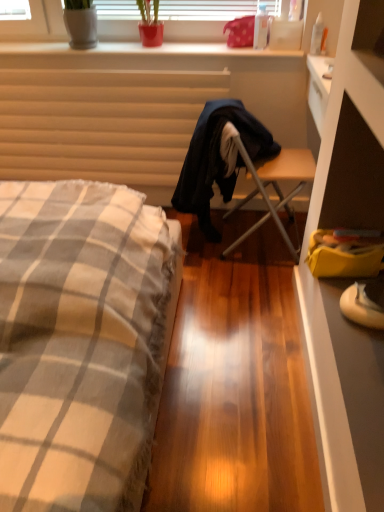
Question: Can you confirm if dark blue fabric robe at center is positioned to the left of checkered fabric bed at left?

Choices:
 (A) no
 (B) yes

Answer: (A)

Question: Is dark blue fabric robe at center surrounding checkered fabric bed at left?

Choices:
 (A) yes
 (B) no

Answer: (B)

Question: Does dark blue fabric robe at center have a lesser width compared to checkered fabric bed at left?

Choices:
 (A) no
 (B) yes

Answer: (B)

Question: Could you tell me if dark blue fabric robe at center is turned towards checkered fabric bed at left?

Choices:
 (A) yes
 (B) no

Answer: (B)

Question: Is dark blue fabric robe at center located outside checkered fabric bed at left?

Choices:
 (A) yes
 (B) no

Answer: (A)

Question: From the image's perspective, is smooth white surface at upper center above or below checkered fabric bed at left?

Choices:
 (A) above
 (B) below

Answer: (A)

Question: Looking at their shapes, would you say smooth white surface at upper center is wider or thinner than checkered fabric bed at left?

Choices:
 (A) wide
 (B) thin

Answer: (B)

Question: From a real-world perspective, relative to checkered fabric bed at left, is smooth white surface at upper center vertically above or below?

Choices:
 (A) above
 (B) below

Answer: (A)

Question: Considering the relative positions of smooth white surface at upper center and checkered fabric bed at left in the image provided, is smooth white surface at upper center to the left or to the right of checkered fabric bed at left?

Choices:
 (A) right
 (B) left

Answer: (A)

Question: From a real-world perspective, relative to transparent plastic bottle at upper right, marked as the first bottle in a right-to-left arrangement, is yellow fabric bag at lower right vertically above or below?

Choices:
 (A) above
 (B) below

Answer: (B)

Question: Is point (322, 245) closer or farther from the camera than point (316, 31)?

Choices:
 (A) farther
 (B) closer

Answer: (B)

Question: Visually, is yellow fabric bag at lower right positioned to the left or to the right of transparent plastic bottle at upper right, positioned as the second bottle in left-to-right order?

Choices:
 (A) left
 (B) right

Answer: (A)

Question: In the image, is yellow fabric bag at lower right positioned in front of or behind transparent plastic bottle at upper right, marked as the first bottle in a right-to-left arrangement?

Choices:
 (A) behind
 (B) front

Answer: (B)

Question: Is wooden folding chair at center situated inside green matte plant at upper center or outside?

Choices:
 (A) outside
 (B) inside

Answer: (A)

Question: Relative to green matte plant at upper center, is wooden folding chair at center in front or behind?

Choices:
 (A) front
 (B) behind

Answer: (A)